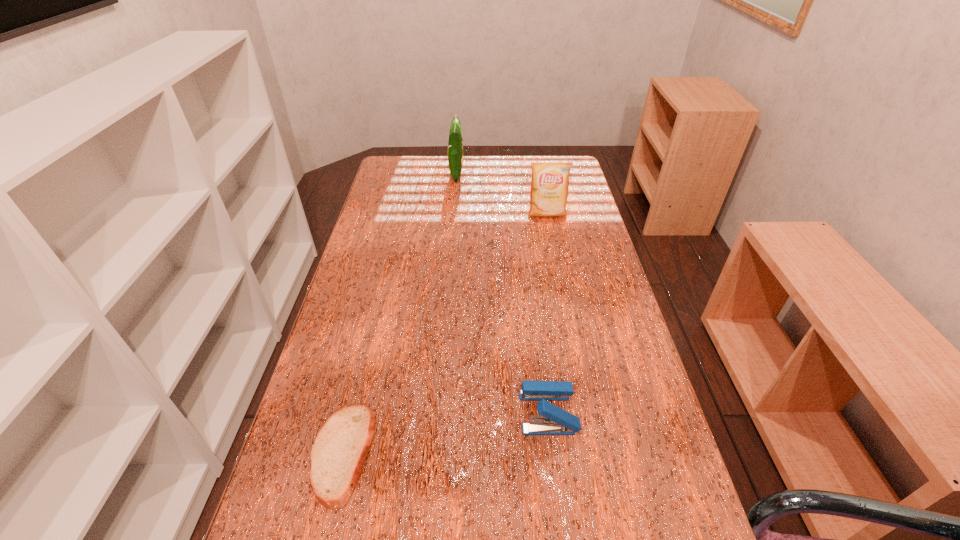
Locate an element on the screen. This screenshot has width=960, height=540. free space located 0.270m on the right of the leftmost object is located at coordinates (507, 454).

What are the coordinates of `object present at the far edge` in the screenshot? It's located at (455, 144).

Find the location of a particular element. The width and height of the screenshot is (960, 540). object at the left edge is located at coordinates (339, 451).

Locate an element on the screen. object present at the right edge is located at coordinates (550, 180).

The height and width of the screenshot is (540, 960). I want to click on free spot at the far edge of the desktop, so click(x=501, y=178).

In the image, there is a desktop. Where is `vacant region at the left edge`? This screenshot has width=960, height=540. vacant region at the left edge is located at coordinates (393, 192).

The height and width of the screenshot is (540, 960). I want to click on free spot at the right edge of the desktop, so click(615, 395).

At what (x,y) coordinates should I click in order to perform the action: click on vacant region at the far left corner of the desktop. Please return your answer as a coordinate pair (x, y). This screenshot has width=960, height=540. Looking at the image, I should click on (394, 161).

This screenshot has width=960, height=540. I want to click on vacant space at the far right corner of the desktop, so click(x=563, y=161).

This screenshot has height=540, width=960. Identify the location of vacant space in between the shortest object and the right crisp (potato chip). (444, 334).